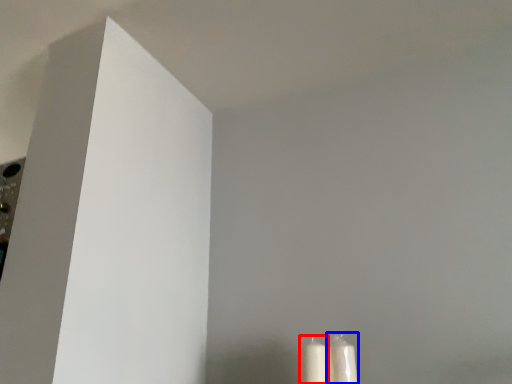
Question: Which point is further to the camera, candle (highlighted by a red box) or candle (highlighted by a blue box)?

Choices:
 (A) candle
 (B) candle

Answer: (B)